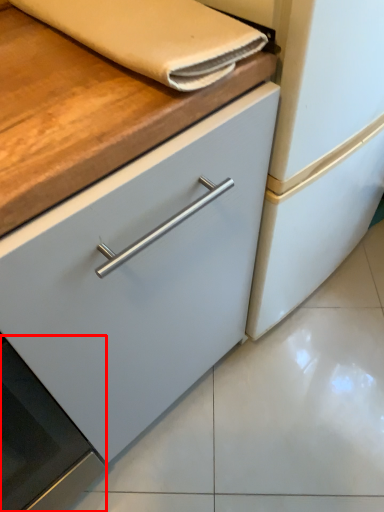
Question: From the image's perspective, considering the relative positions of oven (annotated by the red box) and hand towel in the image provided, where is oven (annotated by the red box) located with respect to the staircase?

Choices:
 (A) above
 (B) below

Answer: (B)